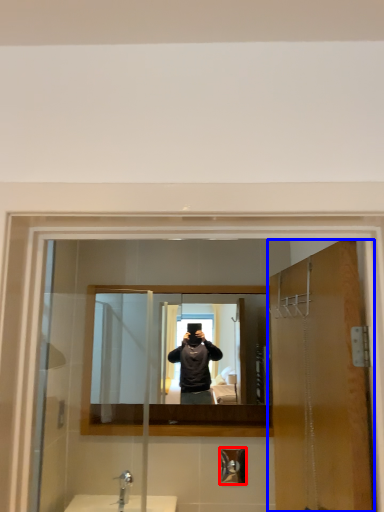
Question: Which object is closer to the camera taking this photo, shower (highlighted by a red box) or door (highlighted by a blue box)?

Choices:
 (A) shower
 (B) door

Answer: (B)